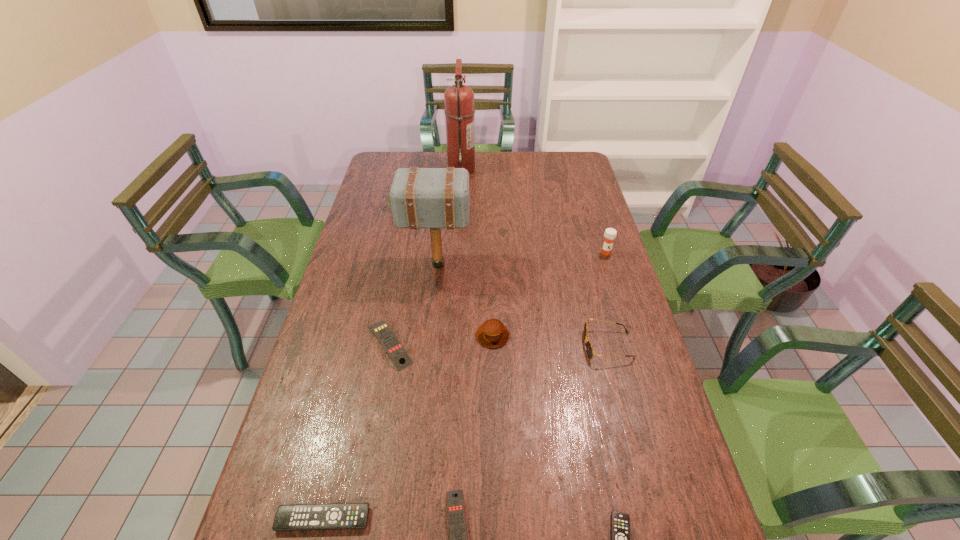
Identify which remote control is the third nearest to the right black remote control. Please provide its 2D coordinates. Your answer should be formatted as a tuple, i.e. [(x, y)], where the tuple contains the x and y coordinates of a point satisfying the conditions above.

[(397, 353)]

Where is `free spot that satisfies the following two spatial constraints: 1. on the striking surface of the gray mallet; 2. on the back side of the brown muffin`? The height and width of the screenshot is (540, 960). free spot that satisfies the following two spatial constraints: 1. on the striking surface of the gray mallet; 2. on the back side of the brown muffin is located at coordinates (430, 335).

Locate an element on the screen. The height and width of the screenshot is (540, 960). vacant space that satisfies the following two spatial constraints: 1. on the lenses of the sixth tallest object; 2. on the front side of the left black remote control is located at coordinates (653, 519).

The height and width of the screenshot is (540, 960). Find the location of `vacant space that satisfies the following two spatial constraints: 1. on the striking surface of the mallet; 2. on the front side of the tallest remote control`. vacant space that satisfies the following two spatial constraints: 1. on the striking surface of the mallet; 2. on the front side of the tallest remote control is located at coordinates (429, 345).